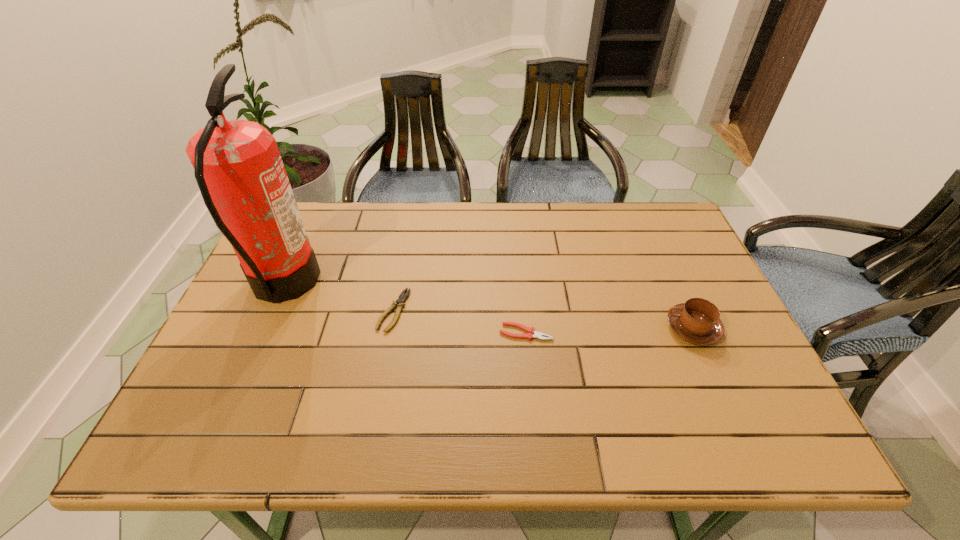
Locate an element on the screen. The height and width of the screenshot is (540, 960). vacant space located on the left of the second object from left to right is located at coordinates pyautogui.click(x=248, y=310).

Find the location of a particular element. This screenshot has width=960, height=540. blank area located 0.400m on the back of the second object from right to left is located at coordinates (516, 226).

The width and height of the screenshot is (960, 540). Find the location of `object that is positioned at the left edge`. object that is positioned at the left edge is located at coordinates (237, 164).

Identify the location of object that is positioned at the right edge. [697, 321].

In the image, there is a desktop. Identify the location of vacant area at the far edge. This screenshot has width=960, height=540. (391, 207).

In the image, there is a desktop. Identify the location of vacant space at the left edge. (222, 410).

Locate an element on the screen. This screenshot has height=540, width=960. free location at the far left corner is located at coordinates (319, 207).

This screenshot has width=960, height=540. In the image, there is a desktop. What are the coordinates of `vacant space at the far right corner` in the screenshot? It's located at pyautogui.click(x=632, y=204).

Find the location of `empty space between the left pliers and the fire extinguisher`. empty space between the left pliers and the fire extinguisher is located at coordinates (339, 297).

Find the location of a particular element. free point between the leftmost object and the left pliers is located at coordinates (339, 297).